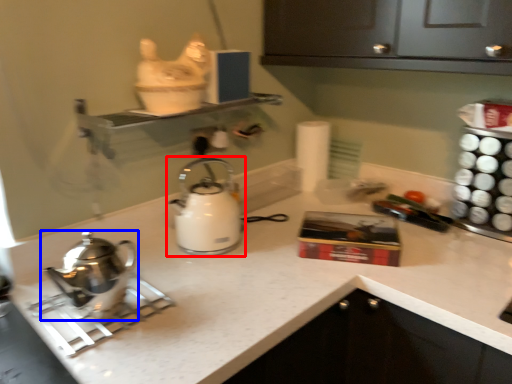
Question: Which object is closer to the camera taking this photo, kettle (highlighted by a red box) or kettle (highlighted by a blue box)?

Choices:
 (A) kettle
 (B) kettle

Answer: (B)